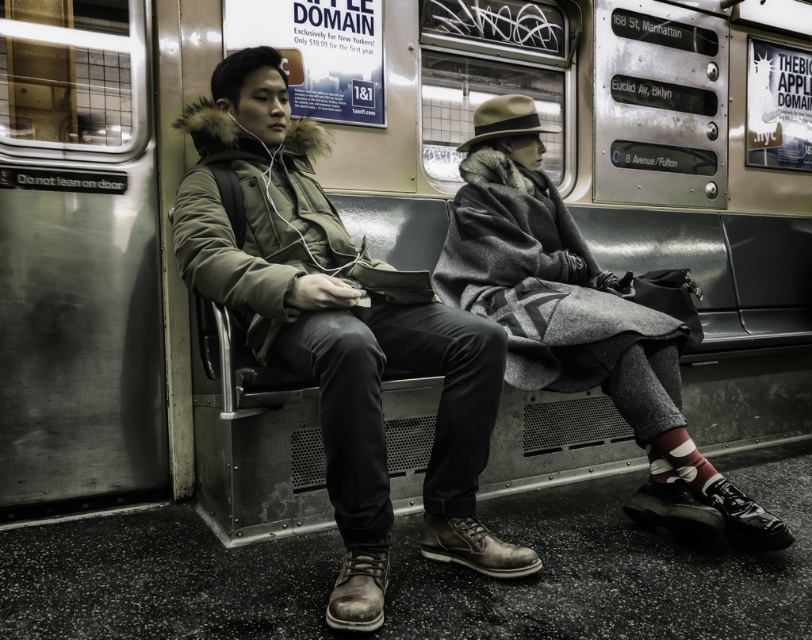
Question: Can you confirm if matte green coat at center is wider than gray wool coat at center?

Choices:
 (A) yes
 (B) no

Answer: (A)

Question: Can you confirm if matte green coat at center is wider than gray wool coat at center?

Choices:
 (A) no
 (B) yes

Answer: (B)

Question: Which of the following is the farthest from the observer?

Choices:
 (A) gray wool coat at center
 (B) matte green coat at center

Answer: (A)

Question: Where is matte green coat at center located in relation to gray wool coat at center in the image?

Choices:
 (A) above
 (B) below

Answer: (B)

Question: Which point is closer to the camera?

Choices:
 (A) (614, 388)
 (B) (499, 125)

Answer: (A)